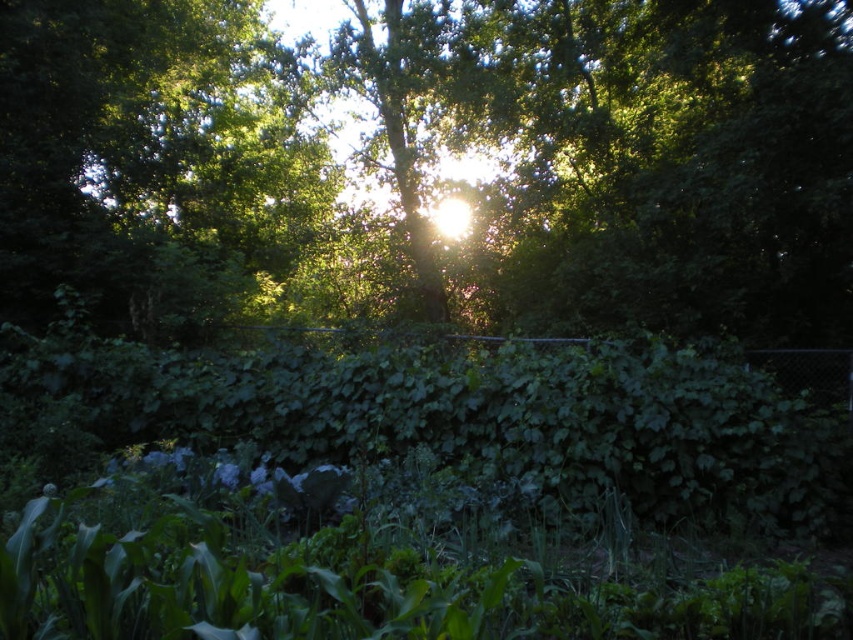
Is point (70, 13) farther from viewer compared to point (558, 465)?

Yes, it is behind point (558, 465).

Is the position of green leafy tree at center more distant than that of green leafy hedge at center?

Yes, it is.

Identify the location of green leafy tree at center. This screenshot has height=640, width=853. (433, 164).